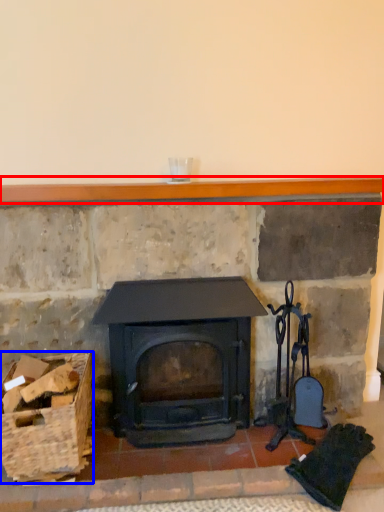
Question: Which point is closer to the camera, balustrade (highlighted by a red box) or basket (highlighted by a blue box)?

Choices:
 (A) balustrade
 (B) basket

Answer: (B)